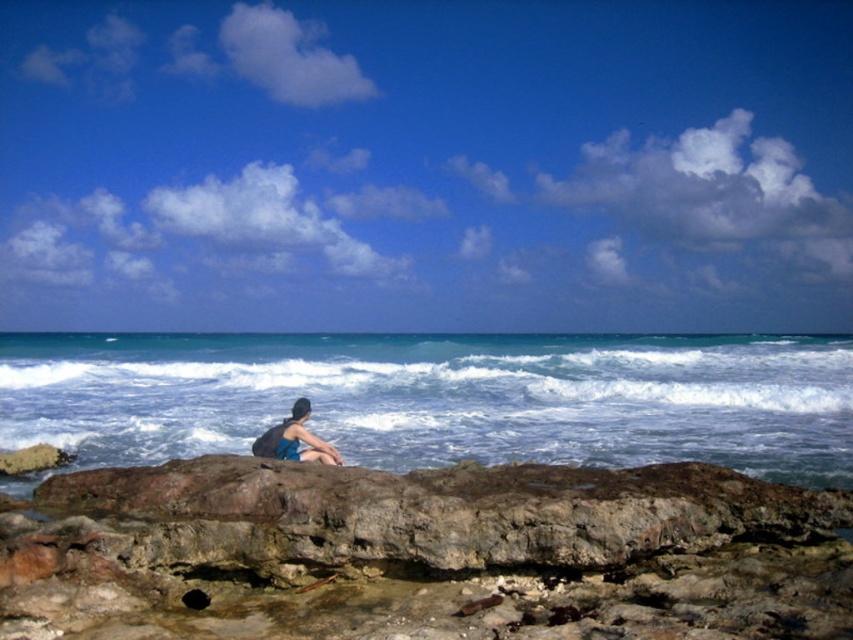
Between rusty rock at lower center and blue fabric shorts at center, which one appears on the right side from the viewer's perspective?

rusty rock at lower center is more to the right.

Between rusty rock at lower center and blue fabric shorts at center, which one is positioned lower?

rusty rock at lower center is below.

Where is `rusty rock at lower center`? The image size is (853, 640). rusty rock at lower center is located at coordinates (422, 554).

You are a GUI agent. You are given a task and a screenshot of the screen. Output one action in this format:
    pyautogui.click(x=<x>, y=<y>)
    Task: Click on the rusty rock at lower center
    The image size is (853, 640).
    Given the screenshot: What is the action you would take?
    (x=422, y=554)

Find the location of a particular element. Image resolution: width=853 pixels, height=640 pixels. rusty rock at lower center is located at coordinates tap(422, 554).

Between point (828, 563) and point (461, 378), which one is positioned in front?

Point (828, 563)

Describe the element at coordinates (422, 554) in the screenshot. I see `rusty rock at lower center` at that location.

Identify the location of rusty rock at lower center. The width and height of the screenshot is (853, 640). (422, 554).

Can you confirm if blue water at center is wider than blue fabric shorts at center?

Indeed, blue water at center has a greater width compared to blue fabric shorts at center.

Does blue water at center have a greater height compared to blue fabric shorts at center?

Yes.

At what (x,y) coordinates should I click in order to perform the action: click on blue water at center. Please return your answer as a coordinate pair (x, y). Looking at the image, I should click on (440, 397).